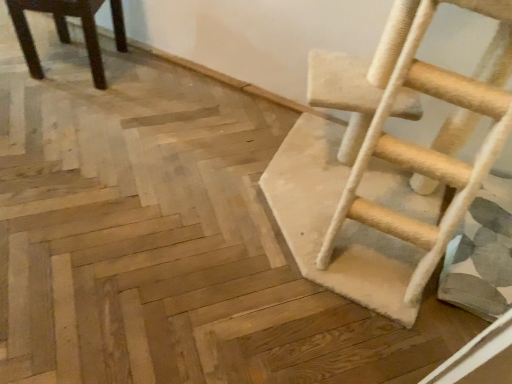
I want to click on vacant area in front of dark brown wood chair at upper left, so click(x=60, y=113).